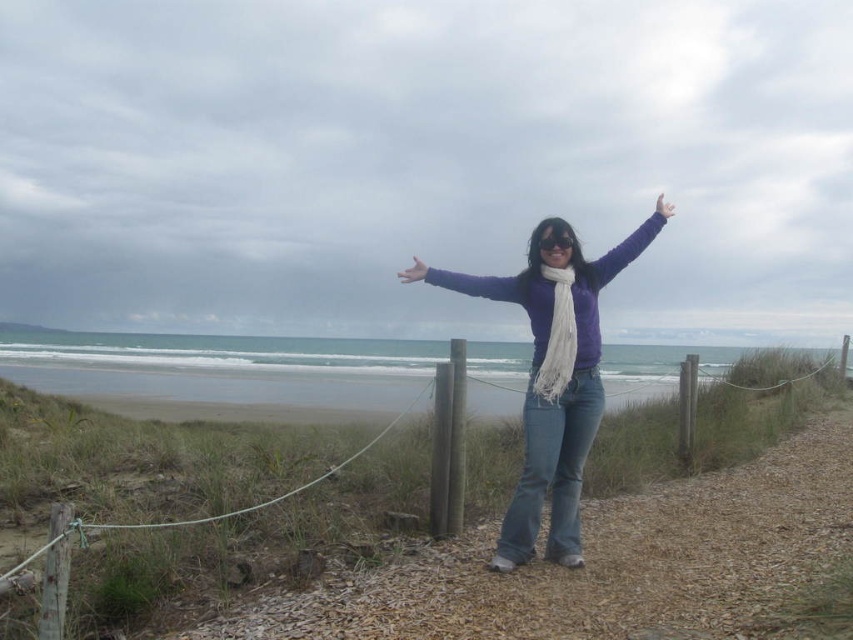
Does white soft scarf at center appear on the left side of purple matte scarf at upper center?

Yes, white soft scarf at center is to the left of purple matte scarf at upper center.

Does white soft scarf at center have a greater width compared to purple matte scarf at upper center?

No, white soft scarf at center is not wider than purple matte scarf at upper center.

Between point (566, 358) and point (604, 282), which one is positioned behind?

The point (604, 282) is more distant.

Where is `white soft scarf at center`? This screenshot has height=640, width=853. white soft scarf at center is located at coordinates (558, 337).

Between purple soft sweater at center and purple fabric arm at center, which one is positioned lower?

Positioned lower is purple soft sweater at center.

Is purple soft sweater at center further to the viewer compared to purple fabric arm at center?

No, it is in front of purple fabric arm at center.

Find the location of `purple soft sweater at center`. purple soft sweater at center is located at coordinates (554, 378).

Is purple soft sweater at center below matte white hand at upper right?

Indeed, purple soft sweater at center is positioned under matte white hand at upper right.

Describe the element at coordinates (554, 378) in the screenshot. The height and width of the screenshot is (640, 853). I see `purple soft sweater at center` at that location.

The width and height of the screenshot is (853, 640). What are the coordinates of `purple soft sweater at center` in the screenshot? It's located at (554, 378).